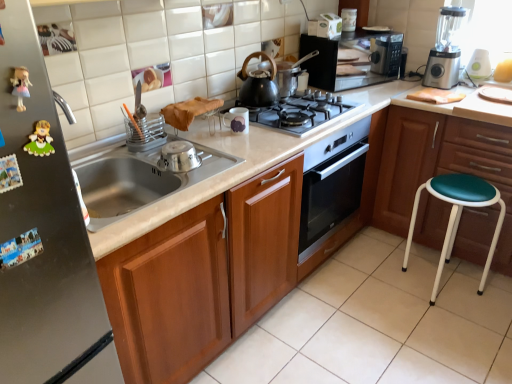
Describe the element at coordinates (44, 237) in the screenshot. This screenshot has height=384, width=512. I see `satin silver fridge at left` at that location.

At what (x,y) coordinates should I click in order to perform the action: click on satin silver fridge at left. Please return your answer as a coordinate pair (x, y). Looking at the image, I should click on (44, 237).

Image resolution: width=512 pixels, height=384 pixels. What do you see at coordinates (237, 119) in the screenshot?
I see `white glossy mug at upper center, which appears as the 2th appliance when viewed from the back` at bounding box center [237, 119].

What is the approximate width of white glossy mug at upper center, which appears as the 2th appliance when viewed from the back?

The width of white glossy mug at upper center, which appears as the 2th appliance when viewed from the back, is 11.08 centimeters.

This screenshot has width=512, height=384. What do you see at coordinates (441, 166) in the screenshot? I see `green leather stool at right` at bounding box center [441, 166].

You are a GUI agent. You are given a task and a screenshot of the screen. Output one action in this format:
    pyautogui.click(x=<x>, y=<y>)
    Task: Click on the plastic figurine at left
    
    Given the screenshot: What is the action you would take?
    pyautogui.click(x=40, y=140)

I want to click on black matte microwave at upper right, so click(353, 59).

Who is more distant, teal vinyl stool at lower right or black matte gas stove at center?

black matte gas stove at center.

From the picture: Between teal vinyl stool at lower right and black matte gas stove at center, which one has smaller width?

With smaller width is teal vinyl stool at lower right.

Which is correct: teal vinyl stool at lower right is inside black matte gas stove at center, or outside of it?

teal vinyl stool at lower right cannot be found inside black matte gas stove at center.

Is black matte microwave at upper right positioned beyond the bounds of black matte gas stove at center?

black matte microwave at upper right is positioned outside black matte gas stove at center.

Considering the positions of objects black matte microwave at upper right and black matte gas stove at center in the image provided, who is more to the right, black matte microwave at upper right or black matte gas stove at center?

black matte microwave at upper right.

From a real-world perspective, relative to black matte gas stove at center, is black matte microwave at upper right vertically above or below?

Clearly, from a real-world perspective, black matte microwave at upper right is above black matte gas stove at center.

Is stainless steel bowl at sink, the 3th appliance in the top-to-bottom sequence, next to white glossy countertop at center and touching it?

stainless steel bowl at sink, the 3th appliance in the top-to-bottom sequence, is not next to white glossy countertop at center, and they're not touching.

Is white glossy countertop at center a part of stainless steel bowl at sink, the 1th appliance positioned from the bottom?

No.

Which is in front, stainless steel bowl at sink, the 1th appliance positioned from the bottom, or white glossy countertop at center?

white glossy countertop at center is closer to the camera.

Considering the sizes of objects stainless steel bowl at sink, the 3th appliance in the top-to-bottom sequence, and black matte gas stove at center in the image provided, who is bigger, stainless steel bowl at sink, the 3th appliance in the top-to-bottom sequence, or black matte gas stove at center?

Bigger between the two is black matte gas stove at center.

From a real-world perspective, is stainless steel bowl at sink, which ranks as the 3th appliance in back-to-front order, located beneath black matte gas stove at center?

No, from a real-world perspective, stainless steel bowl at sink, which ranks as the 3th appliance in back-to-front order, is not beneath black matte gas stove at center.

Between stainless steel bowl at sink, the third appliance when ordered from right to left, and black matte gas stove at center, which one has less height?

With less height is stainless steel bowl at sink, the third appliance when ordered from right to left.

In the scene shown: From the image's perspective, which object appears higher, stainless steel bowl at sink, placed as the first appliance when sorted from left to right, or black matte gas stove at center?

black matte gas stove at center.

Looking at this image, is satin silver fridge at left aimed at green leather stool at right?

No, satin silver fridge at left is not oriented towards green leather stool at right.

From the image's perspective, between satin silver fridge at left and green leather stool at right, which one is located above?

green leather stool at right appears higher in the image.

Which of these two, satin silver fridge at left or green leather stool at right, stands taller?

satin silver fridge at left.

Is satin silver fridge at left at the right side of green leather stool at right?

Incorrect, satin silver fridge at left is not on the right side of green leather stool at right.

From the image's perspective, is white glossy countertop at center on top of green plastic blender at upper right, which is the third appliance from bottom to top?

Incorrect, from the image's perspective, white glossy countertop at center is lower than green plastic blender at upper right, which is the third appliance from bottom to top.

Between white glossy countertop at center and green plastic blender at upper right, which is the first appliance in right-to-left order, which one has smaller size?

Smaller between the two is green plastic blender at upper right, which is the first appliance in right-to-left order.

Can you confirm if white glossy countertop at center is shorter than green plastic blender at upper right, the first appliance viewed from the back?

Incorrect, the height of white glossy countertop at center does not fall short of that of green plastic blender at upper right, the first appliance viewed from the back.

Is white glossy countertop at center oriented away from green plastic blender at upper right, which is the first appliance in right-to-left order?

No, white glossy countertop at center is not facing the opposite direction of green plastic blender at upper right, which is the first appliance in right-to-left order.

From the picture: From the image's perspective, is stainless steel bowl at sink, the 1th appliance positioned from the bottom, under satin silver fridge at left?

No.

Considering the sizes of objects stainless steel bowl at sink, the 3th appliance in the top-to-bottom sequence, and satin silver fridge at left in the image provided, who is wider, stainless steel bowl at sink, the 3th appliance in the top-to-bottom sequence, or satin silver fridge at left?

Wider between the two is satin silver fridge at left.

Considering the relative positions of stainless steel bowl at sink, the third appliance when ordered from right to left, and satin silver fridge at left in the image provided, is stainless steel bowl at sink, the third appliance when ordered from right to left, behind satin silver fridge at left?

That is True.

The width and height of the screenshot is (512, 384). I want to click on the 1st appliance located above the satin silver fridge at left (from a real-world perspective), so click(178, 157).

Image resolution: width=512 pixels, height=384 pixels. Identify the location of stool on the right of the black matte gas stove at center. (457, 215).

You are a GUI agent. You are given a task and a screenshot of the screen. Output one action in this format:
    pyautogui.click(x=<x>, y=<y>)
    Task: Click on the gas stove below the black matte microwave at upper right (from the image's perspective)
    
    Given the screenshot: What is the action you would take?
    pyautogui.click(x=302, y=113)

Estimate the real-world distances between objects in this image. Which object is further from black matte gas stove at center, satin silver blender at upper right or black matte tea pot at center?

satin silver blender at upper right lies further to black matte gas stove at center than the other object.

Looking at the image, which one is located further to satin silver blender at upper right, white glossy countertop at center or teal vinyl stool at lower right?

white glossy countertop at center.

Estimate the real-world distances between objects in this image. Which object is closer to black matte microwave at upper right, satin silver blender at upper right or plastic figurine at left?

The object closer to black matte microwave at upper right is satin silver blender at upper right.

Which object lies nearer to the anchor point stainless steel bowl at sink, the 1th appliance positioned from the bottom, teal vinyl stool at lower right or black matte microwave at upper right?

The object closer to stainless steel bowl at sink, the 1th appliance positioned from the bottom, is teal vinyl stool at lower right.

Based on their spatial positions, is green plastic blender at upper right, the first appliance viewed from the back, or teal vinyl stool at lower right closer to plastic figurine at left?

Among the two, teal vinyl stool at lower right is located nearer to plastic figurine at left.

Based on the photo, from the image, which object appears to be farther from teal vinyl stool at lower right, satin silver fridge at left or satin silver blender at upper right?

satin silver fridge at left is positioned further to the anchor teal vinyl stool at lower right.

Based on their spatial positions, is black matte tea pot at center or green plastic blender at upper right, which is the first appliance in right-to-left order, closer to teal vinyl stool at lower right?

green plastic blender at upper right, which is the first appliance in right-to-left order.

When comparing their distances from plastic figurine at left, does white glossy mug at upper center, which appears as the 2th appliance when viewed from the back, or stainless steel bowl at sink, the third appliance when ordered from right to left, seem closer?

stainless steel bowl at sink, the third appliance when ordered from right to left, is positioned closer to the anchor plastic figurine at left.

You are a GUI agent. You are given a task and a screenshot of the screen. Output one action in this format:
    pyautogui.click(x=<x>, y=<y>)
    Task: Click on the stool between black matte gas stove at center and green plastic blender at upper right, which is the third appliance from bottom to top, in the horizontal direction
    The height and width of the screenshot is (384, 512).
    Given the screenshot: What is the action you would take?
    pyautogui.click(x=457, y=215)

You are a GUI agent. You are given a task and a screenshot of the screen. Output one action in this format:
    pyautogui.click(x=<x>, y=<y>)
    Task: Click on the countertop between white glossy mug at upper center, placed as the second appliance when sorted from left to right, and teal vinyl stool at lower right, in the horizontal direction
    
    Given the screenshot: What is the action you would take?
    pyautogui.click(x=411, y=315)

The image size is (512, 384). What are the coordinates of `tea pot between satin silver fridge at left and green leather stool at right` in the screenshot? It's located at (258, 84).

The width and height of the screenshot is (512, 384). In order to click on home appliance situated between stainless steel bowl at sink, the third appliance when ordered from right to left, and teal vinyl stool at lower right from left to right in this screenshot , I will do `click(353, 59)`.